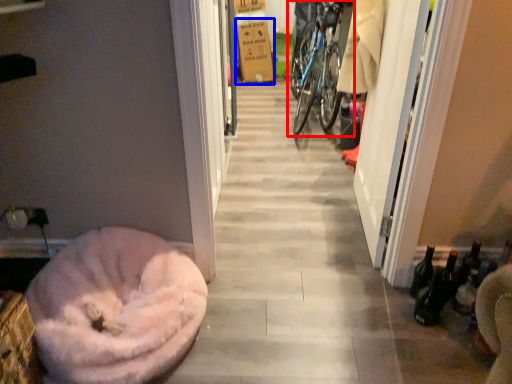
Question: Which point is further to the camera, bicycle (highlighted by a red box) or cardboard box (highlighted by a blue box)?

Choices:
 (A) bicycle
 (B) cardboard box

Answer: (B)